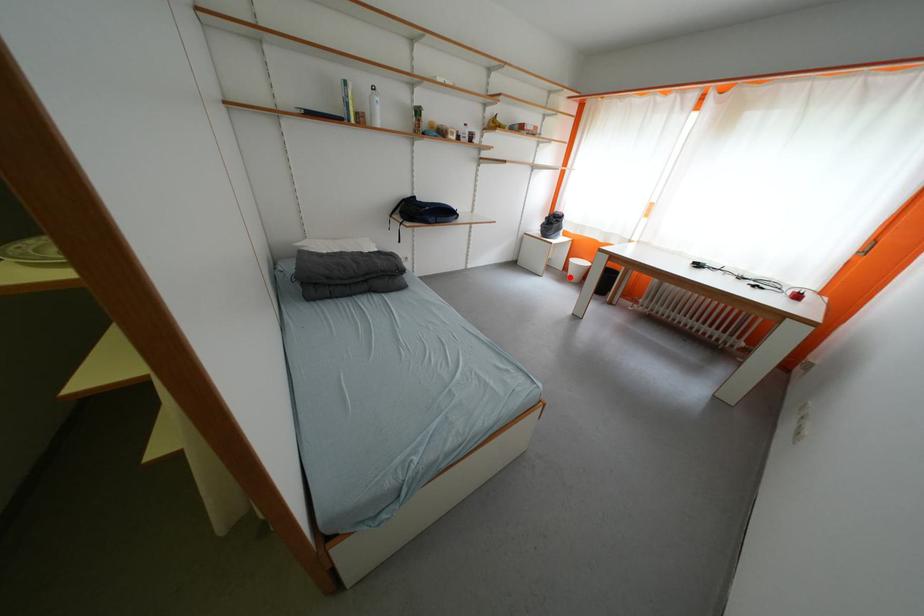
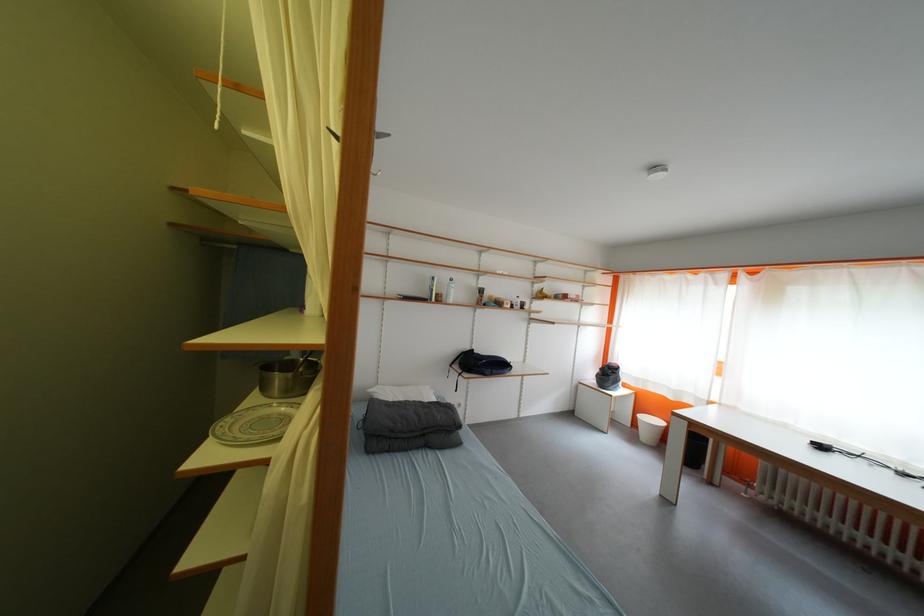
The point at the highlighted location is marked in the first image. Where is the corresponding point in the second image?

(639, 436)